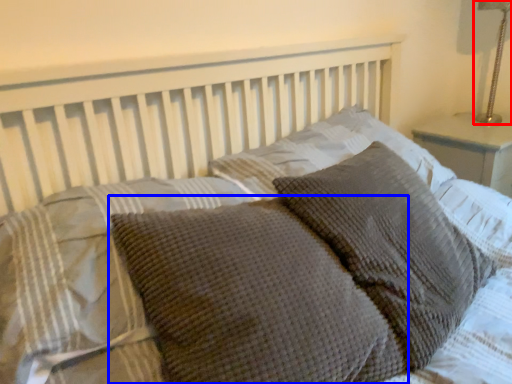
Question: Which point is closer to the camera, bedside lamp (highlighted by a red box) or pillow (highlighted by a blue box)?

Choices:
 (A) bedside lamp
 (B) pillow

Answer: (B)